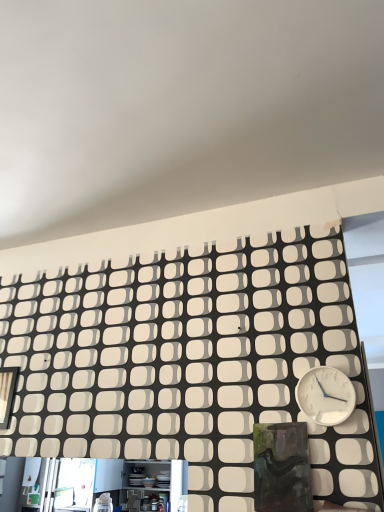
Question: In terms of width, does white plastic wall clock at right look wider or thinner when compared to matte black frame at left?

Choices:
 (A) wide
 (B) thin

Answer: (A)

Question: Looking at the image, does white plastic wall clock at right seem bigger or smaller compared to matte black frame at left?

Choices:
 (A) small
 (B) big

Answer: (B)

Question: Based on their positions, is white plastic wall clock at right located to the left or right of matte black frame at left?

Choices:
 (A) right
 (B) left

Answer: (A)

Question: Is matte black frame at left spatially inside white plastic wall clock at right, or outside of it?

Choices:
 (A) outside
 (B) inside

Answer: (A)

Question: From the image's perspective, is matte black frame at left positioned above or below white plastic wall clock at right?

Choices:
 (A) above
 (B) below

Answer: (B)

Question: Is point (6, 426) positioned closer to the camera than point (331, 379)?

Choices:
 (A) closer
 (B) farther

Answer: (B)

Question: From a real-world perspective, is matte black frame at left positioned above or below white plastic wall clock at right?

Choices:
 (A) above
 (B) below

Answer: (A)